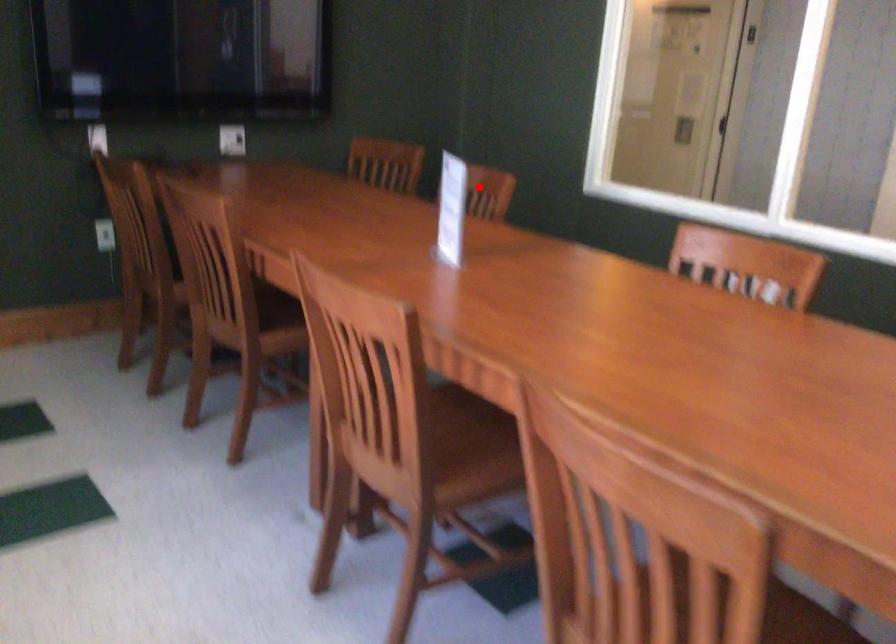
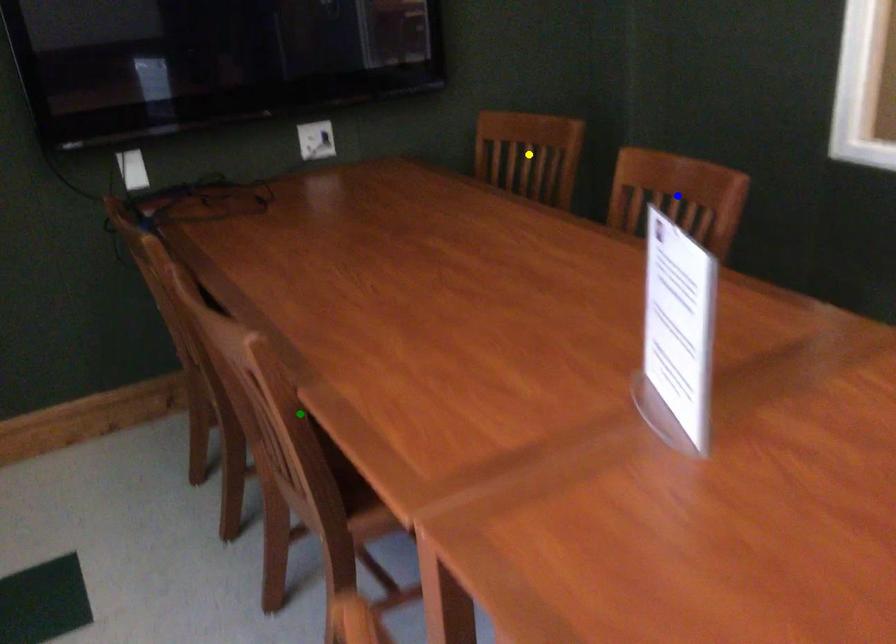
Question: I am providing you with two images of the same scene from different viewpoints. A red point is marked on the first image. You are given multiple points on the second image. Which mark in image 2 goes with the point in image 1?

Choices:
 (A) green point
 (B) blue point
 (C) yellow point

Answer: (B)